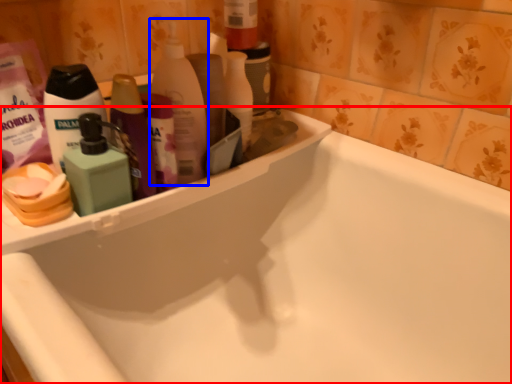
Question: Among these objects, which one is nearest to the camera, bathtub (highlighted by a red box) or cleaning product (highlighted by a blue box)?

Choices:
 (A) bathtub
 (B) cleaning product

Answer: (A)